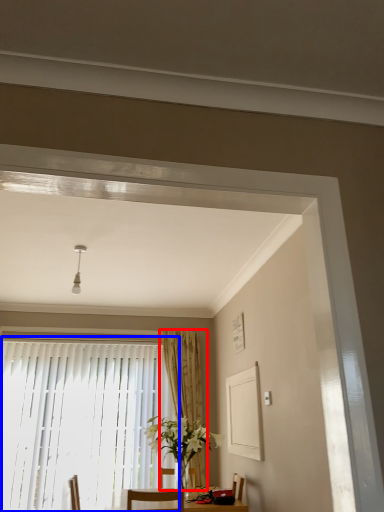
Question: Among these objects, which one is farthest to the camera, curtain (highlighted by a red box) or window (highlighted by a blue box)?

Choices:
 (A) curtain
 (B) window

Answer: (A)